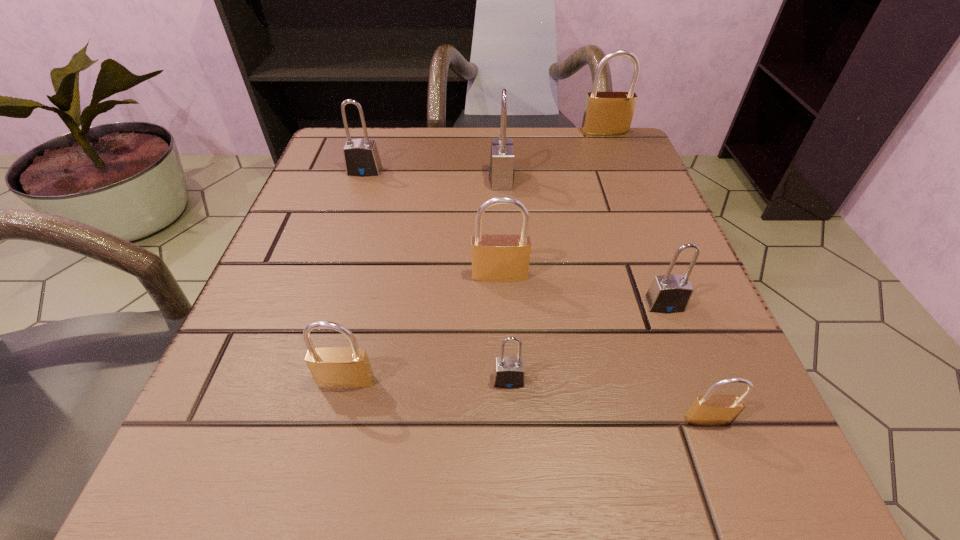
Image resolution: width=960 pixels, height=540 pixels. I want to click on the farthest brass padlock, so click(x=606, y=113).

The height and width of the screenshot is (540, 960). Identify the location of the farthest padlock. [x=606, y=113].

Find the location of a particular element. The height and width of the screenshot is (540, 960). the biggest gray padlock is located at coordinates (501, 171).

Image resolution: width=960 pixels, height=540 pixels. What are the coordinates of `the second biggest gray padlock` in the screenshot? It's located at (361, 157).

Find the location of `the third nearest brass padlock`. the third nearest brass padlock is located at coordinates (495, 257).

The image size is (960, 540). What are the coordinates of `the third smallest brass padlock` in the screenshot? It's located at click(x=495, y=257).

Identify the location of the fifth farthest object. This screenshot has height=540, width=960. (669, 293).

Locate an element on the screen. the third farthest gray padlock is located at coordinates (669, 293).

Locate an element on the screen. This screenshot has width=960, height=540. the second nearest brass padlock is located at coordinates (331, 367).

Find the location of a particular element. This screenshot has height=540, width=960. the third biggest brass padlock is located at coordinates (331, 367).